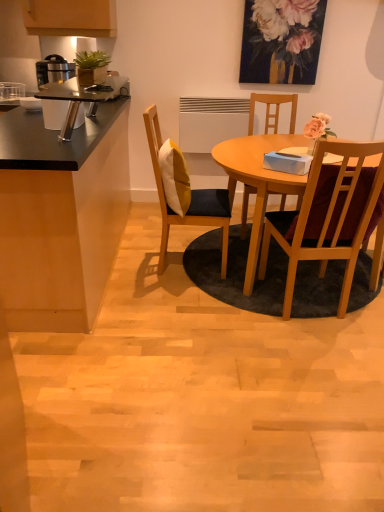
Question: From a real-world perspective, is wooden chair with cushion at center, the 3th chair from the right, below black matte cabinet at left?

Choices:
 (A) yes
 (B) no

Answer: (B)

Question: Does wooden chair with cushion at center, which ranks as the 1th chair in left-to-right order, appear on the right side of black matte cabinet at left?

Choices:
 (A) no
 (B) yes

Answer: (B)

Question: Is wooden chair with cushion at center, which ranks as the 1th chair in left-to-right order, in contact with black matte cabinet at left?

Choices:
 (A) yes
 (B) no

Answer: (B)

Question: Is wooden chair with cushion at center, the 3th chair from the right, behind black matte cabinet at left?

Choices:
 (A) no
 (B) yes

Answer: (B)

Question: Considering the relative sizes of wooden chair with cushion at center, which ranks as the 1th chair in left-to-right order, and black matte cabinet at left in the image provided, is wooden chair with cushion at center, which ranks as the 1th chair in left-to-right order, bigger than black matte cabinet at left?

Choices:
 (A) yes
 (B) no

Answer: (B)

Question: From a real-world perspective, is wooden chair with cushion at center, which ranks as the 1th chair in left-to-right order, positioned above or below wooden chair at center right, the 3th chair from the left?

Choices:
 (A) above
 (B) below

Answer: (B)

Question: In terms of width, does wooden chair with cushion at center, the 3th chair from the right, look wider or thinner when compared to wooden chair at center right, the 3th chair from the left?

Choices:
 (A) thin
 (B) wide

Answer: (B)

Question: Is wooden chair with cushion at center, the 3th chair from the right, to the left or to the right of wooden chair at center right, which ranks as the first chair in right-to-left order, in the image?

Choices:
 (A) right
 (B) left

Answer: (B)

Question: Looking at the image, does wooden chair with cushion at center, the 3th chair from the right, seem bigger or smaller compared to wooden chair at center right, which ranks as the first chair in right-to-left order?

Choices:
 (A) big
 (B) small

Answer: (A)

Question: From a real-world perspective, is black matte cabinet at left above or below wooden chair at center, arranged as the 2th chair when viewed from the right?

Choices:
 (A) above
 (B) below

Answer: (B)

Question: In terms of width, does black matte cabinet at left look wider or thinner when compared to wooden chair at center, which is the second chair in left-to-right order?

Choices:
 (A) thin
 (B) wide

Answer: (B)

Question: Is black matte cabinet at left to the left or to the right of wooden chair at center, which is the second chair in left-to-right order, in the image?

Choices:
 (A) right
 (B) left

Answer: (B)

Question: Relative to wooden chair at center, arranged as the 2th chair when viewed from the right, is black matte cabinet at left in front or behind?

Choices:
 (A) behind
 (B) front

Answer: (B)

Question: Considering their positions, is wooden chair at center, which is the second chair in left-to-right order, located in front of or behind floral painting at upper center?

Choices:
 (A) behind
 (B) front

Answer: (B)

Question: Is point (263, 95) positioned closer to the camera than point (264, 6)?

Choices:
 (A) farther
 (B) closer

Answer: (A)